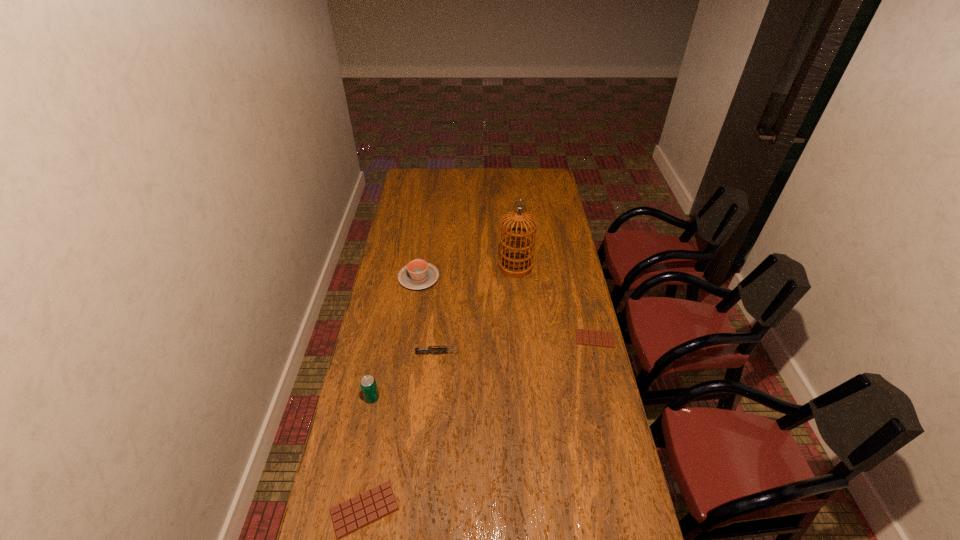
Find the location of a particular element. Image resolution: width=960 pixels, height=540 pixels. the right candy bar is located at coordinates (583, 337).

Where is `the rightmost object`? The width and height of the screenshot is (960, 540). the rightmost object is located at coordinates (583, 337).

Where is `the fourth farthest object`? the fourth farthest object is located at coordinates (418, 350).

The image size is (960, 540). I want to click on the fourth tallest object, so click(418, 350).

Identify the location of chinaware. (418, 274).

Locate an element on the screen. The width and height of the screenshot is (960, 540). the tallest object is located at coordinates (516, 264).

Where is `birdcage`? birdcage is located at coordinates (516, 264).

Locate an element on the screen. The height and width of the screenshot is (540, 960). the fifth shortest object is located at coordinates (368, 384).

You are a GUI agent. You are given a task and a screenshot of the screen. Output one action in this format:
    pyautogui.click(x=<x>, y=<y>)
    Task: Click on the fifth farthest object
    
    Given the screenshot: What is the action you would take?
    pyautogui.click(x=368, y=384)

Locate an element on the screen. vacant space located 0.100m on the back of the fourth nearest object is located at coordinates (588, 312).